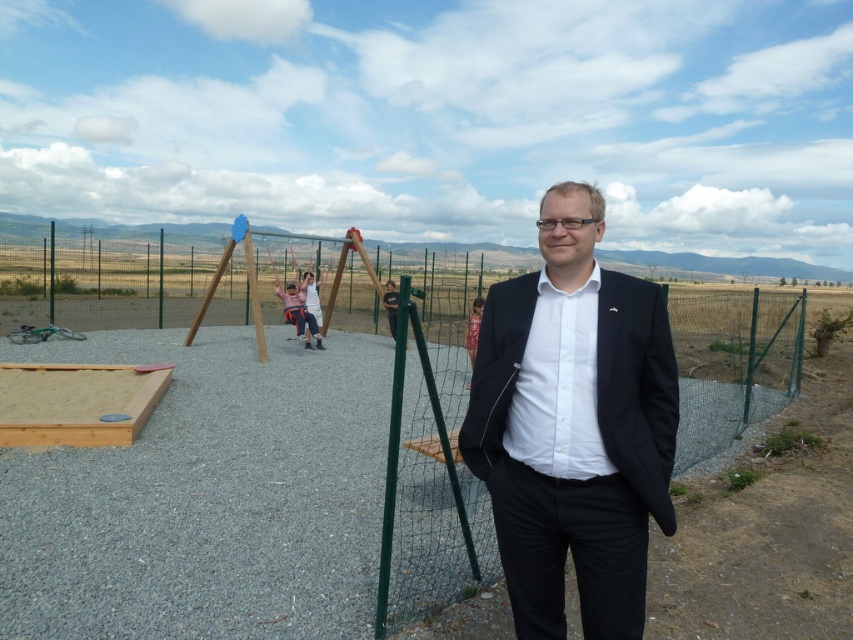
Question: Is black matte suit at center behind matte pink swing at center?

Choices:
 (A) yes
 (B) no

Answer: (B)

Question: Which point is farther to the camera?

Choices:
 (A) matte pink swing at center
 (B) green wire mesh fence at right
 (C) wooden swing set at center
 (D) black matte suit at center

Answer: (A)

Question: Is wooden swing set at center bigger than black matte suit at center?

Choices:
 (A) yes
 (B) no

Answer: (A)

Question: Which object is positioned closest to the wooden swing set at center?

Choices:
 (A) black matte suit at center
 (B) matte pink swing at center

Answer: (A)

Question: Can you confirm if wooden swing set at center is wider than matte pink swing at center?

Choices:
 (A) yes
 (B) no

Answer: (A)

Question: Which object appears farthest from the camera in this image?

Choices:
 (A) green wire mesh fence at right
 (B) wooden swing set at center
 (C) matte pink swing at center
 (D) black matte suit at center

Answer: (C)